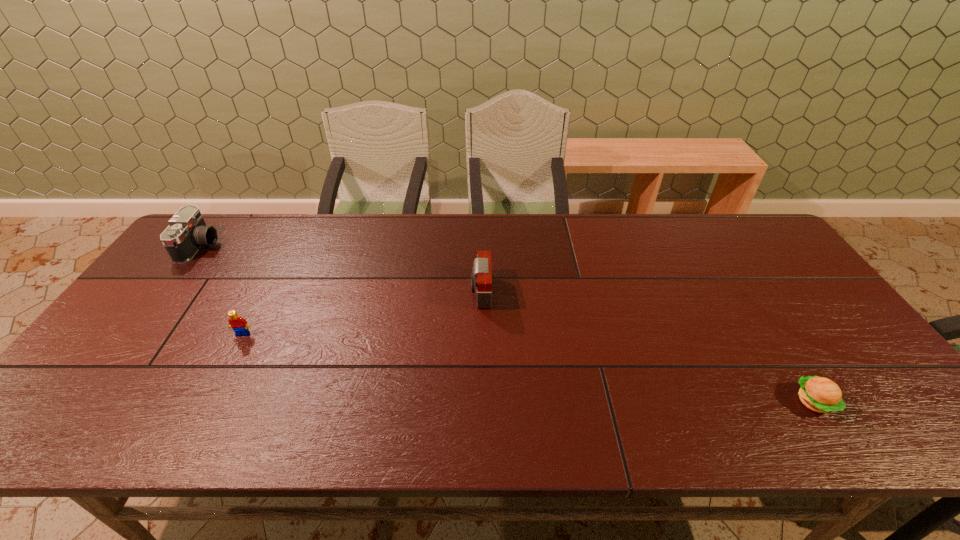
Identify the location of free space between the shortest object and the Lego. (528, 368).

The image size is (960, 540). Identify the location of empty location between the nearer camera and the shortest object. (647, 347).

The width and height of the screenshot is (960, 540). I want to click on free space between the third tallest object and the second object from right to left, so click(362, 313).

Locate an element on the screen. This screenshot has height=540, width=960. object identified as the second closest to the rightmost object is located at coordinates (239, 325).

Where is `object that is the second nearest to the left camera`? The image size is (960, 540). object that is the second nearest to the left camera is located at coordinates (481, 276).

This screenshot has height=540, width=960. I want to click on vacant position in the image that satisfies the following two spatial constraints: 1. on the front-facing side of the third object from right to left; 2. on the right side of the nearest object, so click(207, 402).

The image size is (960, 540). In order to click on vacant space that satisfies the following two spatial constraints: 1. on the front-facing side of the left camera; 2. on the left side of the rightmost object in this screenshot , I will do `click(82, 402)`.

At what (x,y) coordinates should I click in order to perform the action: click on vacant region that satisfies the following two spatial constraints: 1. on the front-facing side of the second farthest object; 2. on the right side of the rightmost object. Please return your answer as a coordinate pair (x, y). The height and width of the screenshot is (540, 960). Looking at the image, I should click on (481, 402).

The width and height of the screenshot is (960, 540). Find the location of `vacant area in the image that satisfies the following two spatial constraints: 1. on the front-facing side of the nearest object; 2. on the right side of the third tallest object`. vacant area in the image that satisfies the following two spatial constraints: 1. on the front-facing side of the nearest object; 2. on the right side of the third tallest object is located at coordinates (207, 402).

The image size is (960, 540). In order to click on free space that satisfies the following two spatial constraints: 1. on the front-facing side of the farthest object; 2. on the left side of the shortest object in this screenshot , I will do `click(82, 402)`.